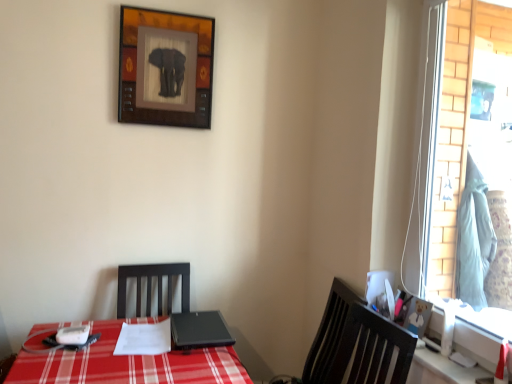
Question: From the image's perspective, relative to black matte laptop at center, is wooden bear picture frame at right, which appears as the 2th picture frame when viewed from the top, above or below?

Choices:
 (A) above
 (B) below

Answer: (A)

Question: Considering their positions, is wooden bear picture frame at right, the 1th picture frame viewed from the right, located in front of or behind black matte laptop at center?

Choices:
 (A) front
 (B) behind

Answer: (A)

Question: Estimate the real-world distances between objects in this image. Which object is farther from the wooden bear picture frame at right, the 1th picture frame viewed from the right?

Choices:
 (A) black matte laptop at center
 (B) light blue fabric at right
 (C) glass window at right
 (D) dark wood chair at right
 (E) wooden framed elephant at upper center, placed as the second picture frame when sorted from front to back

Answer: (E)

Question: Which of these objects is positioned farthest from the light blue fabric at right?

Choices:
 (A) wooden framed elephant at upper center, which appears as the 1th picture frame when viewed from the top
 (B) dark wood chair at right
 (C) black matte laptop at center
 (D) wooden bear picture frame at right, the first picture frame in the front-to-back sequence
 (E) glass window at right

Answer: (A)